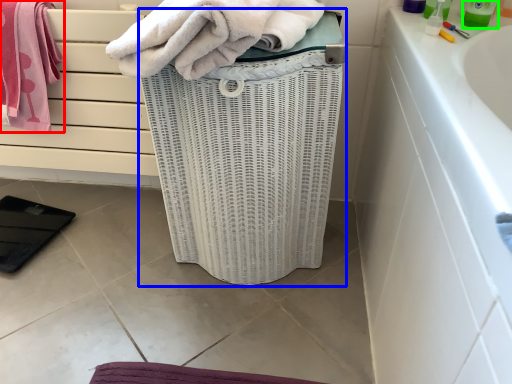
Question: Which is farther away from towel (highlighted by a red box)? basket container (highlighted by a blue box) or cleaning product (highlighted by a green box)?

Choices:
 (A) basket container
 (B) cleaning product

Answer: (B)